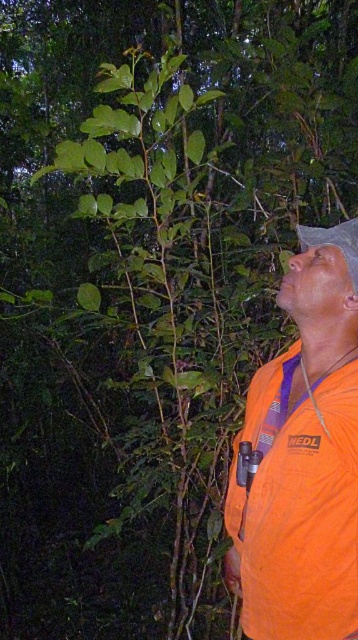
Between point (303, 604) and point (352, 272), which one is positioned behind?

The point (352, 272) is behind.

This screenshot has width=358, height=640. I want to click on orange fabric shirt at right, so click(302, 458).